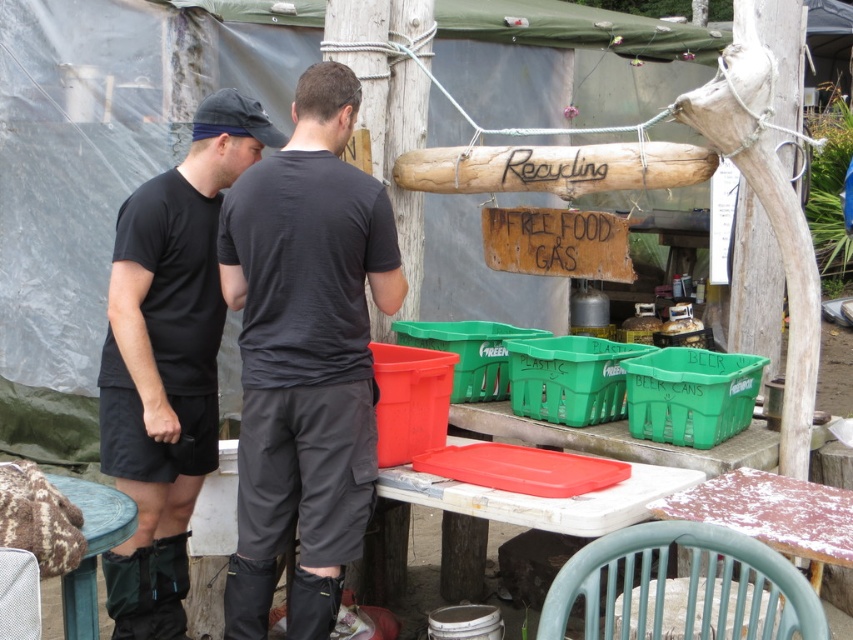
You are standing at the recycling station and want to place a new sign between the two points, point (148,584) and point (90,515). Which point should the sign be closer to if you want it to appear closer to you?

The sign should be placed closer to point (148,584) because it is further to the viewer than point (90,515).